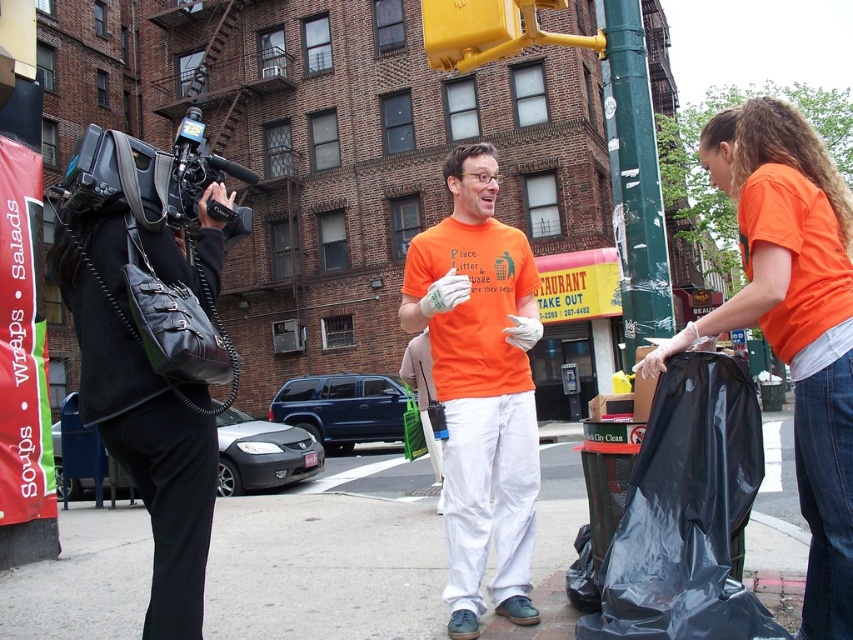
Question: Which object appears farthest from the camera in this image?

Choices:
 (A) black plastic bag at lower right
 (B) black plastic video camera at left
 (C) orange fabric shirt at center
 (D) orange cotton shirt at center

Answer: (D)

Question: Is black plastic bag at lower right positioned behind black plastic video camera at left?

Choices:
 (A) no
 (B) yes

Answer: (A)

Question: Is orange fabric shirt at center positioned in front of black plastic video camera at left?

Choices:
 (A) no
 (B) yes

Answer: (B)

Question: Which object is the closest to the orange cotton shirt at center?

Choices:
 (A) black plastic bag at lower right
 (B) black plastic video camera at left
 (C) orange fabric shirt at center

Answer: (A)

Question: Estimate the real-world distances between objects in this image. Which object is farther from the orange fabric shirt at center?

Choices:
 (A) black plastic bag at lower right
 (B) orange cotton shirt at center
 (C) black plastic video camera at left

Answer: (C)

Question: Is orange fabric shirt at center positioned at the back of black plastic bag at lower right?

Choices:
 (A) yes
 (B) no

Answer: (A)